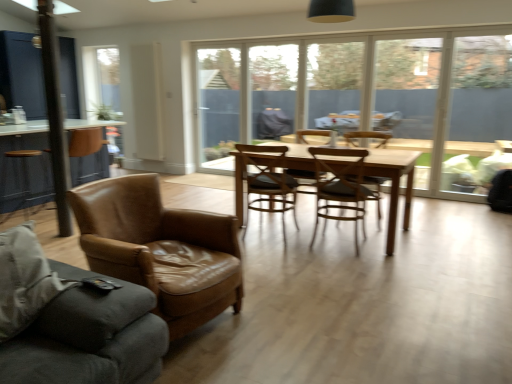
Identify the location of vacant space to the right of light brown wooden table at center. This screenshot has height=384, width=512. (458, 232).